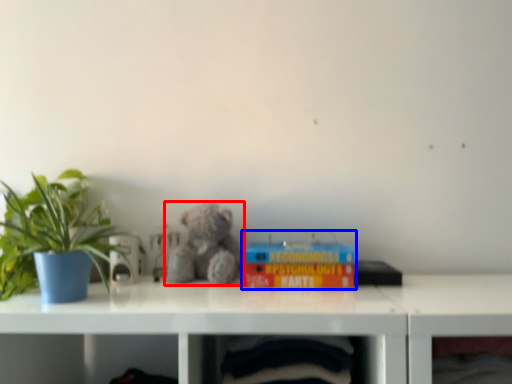
Question: Which of the following is the closest to the observer, teddy bear (highlighted by a red box) or toy (highlighted by a blue box)?

Choices:
 (A) teddy bear
 (B) toy

Answer: (B)